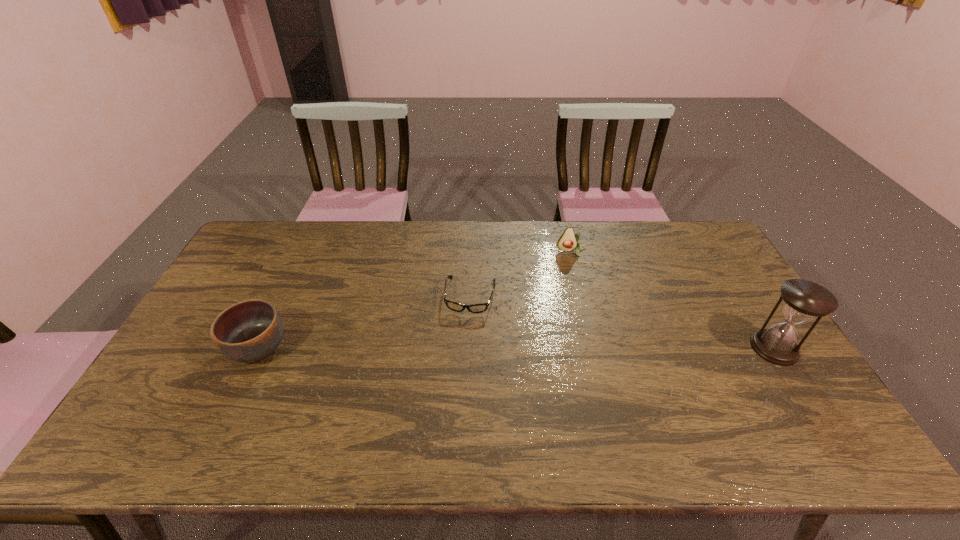
Find the location of a particular element. This screenshot has width=960, height=540. vacant space on the desktop that is between the bowl and the rightmost object and is positioned on the front-facing side of the second farthest object is located at coordinates (461, 348).

The height and width of the screenshot is (540, 960). I want to click on free spot on the desktop that is between the leftmost object and the hourglass and is positioned on the seed side of the farthest object, so click(591, 348).